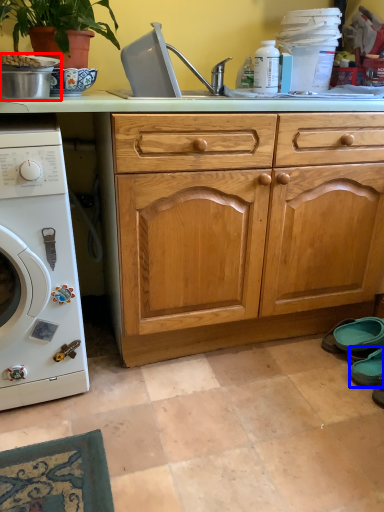
Question: Which point is closer to the camera, appliance (highlighted by a red box) or shoe (highlighted by a blue box)?

Choices:
 (A) appliance
 (B) shoe

Answer: (A)